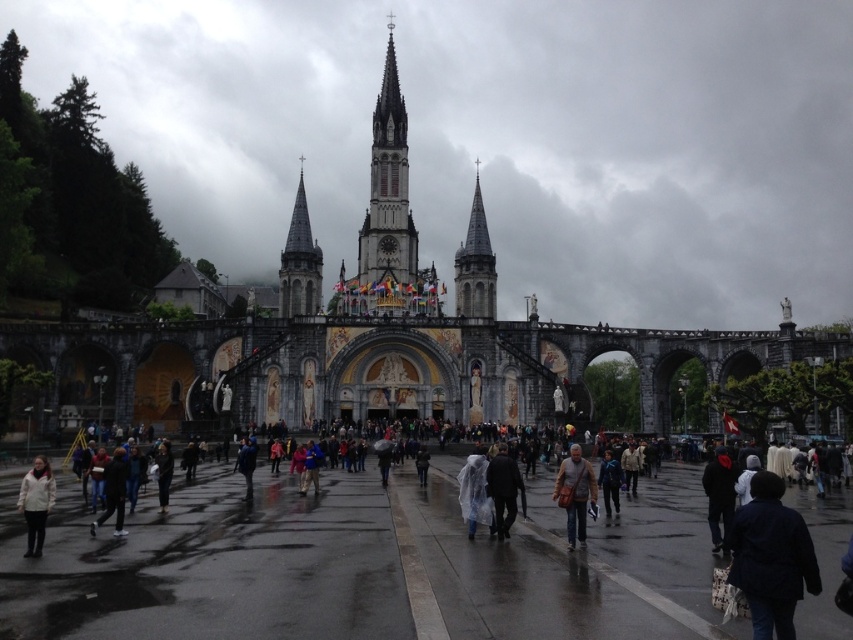
Question: Which point is closer to the camera?

Choices:
 (A) (608, 493)
 (B) (469, 285)
 (C) (100, 515)
 (D) (467, 513)

Answer: (D)

Question: Can you confirm if dark blue jacket at lower left is positioned below dark gray jacket at center?

Choices:
 (A) yes
 (B) no

Answer: (A)

Question: Does white matte jacket at lower left have a smaller size compared to transparent plastic raincoat at center?

Choices:
 (A) no
 (B) yes

Answer: (A)

Question: Which point is closer to the camera?

Choices:
 (A) (526, 96)
 (B) (790, 572)
 (C) (612, 474)
 (D) (21, 621)

Answer: (B)

Question: Can you confirm if stone church at center is positioned to the right of raincoat fabric at center?

Choices:
 (A) no
 (B) yes

Answer: (A)

Question: Which of the following is the closest to the observer?

Choices:
 (A) white matte jacket at lower left
 (B) dark blue jacket at lower right
 (C) transparent plastic raincoat at center
 (D) dark blue jacket at center

Answer: (B)